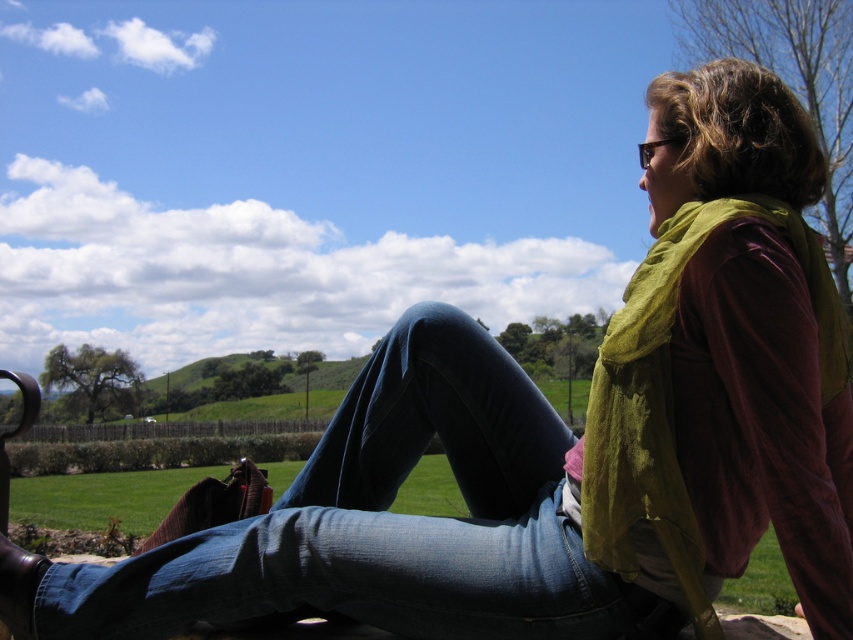
You are a photographer trying to capture the person in the scene. You notice the denim at center and the green sheer scarf at upper right. Which item should you focus on if you want to highlight something larger in your photo?

The denim at center is larger than the green sheer scarf at upper right, so focusing on the denim at center would highlight the larger item in the photo.

You are a photographer trying to capture the person in the scene. You notice the denim at center and the green sheer scarf at upper right. Which object is shorter in height?

The denim at center has a lesser height compared to the green sheer scarf at upper right, so the denim at center is shorter in height.

You are standing at a distance of 6 feet from the point marked as point (51, 580). Can you confirm if you are closer than the recommended social distancing guideline of 6 feet?

The distance of point (51, 580) from viewer is 5.96 feet, so you are slightly closer than the recommended social distancing guideline of 6 feet.